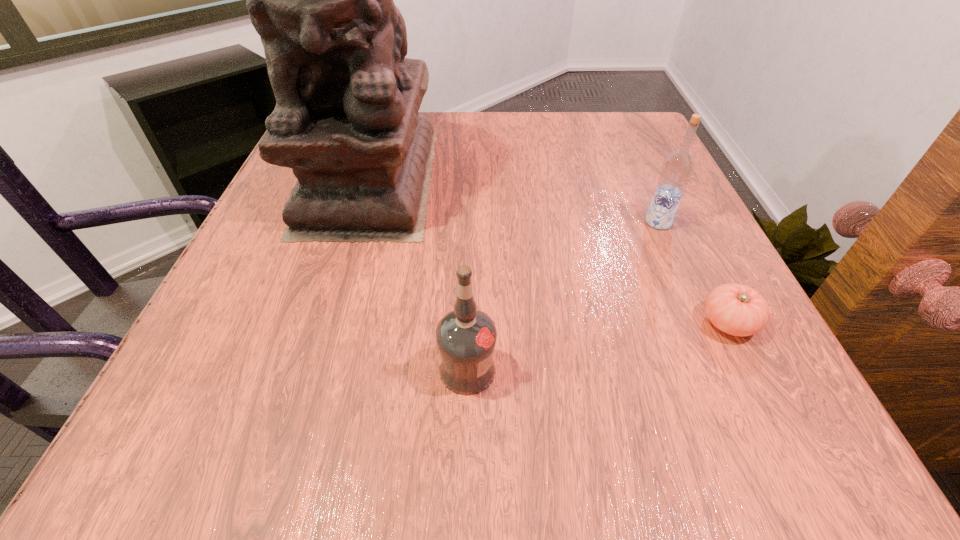
I want to click on free space at the far right corner of the desktop, so click(x=658, y=145).

Where is `free space at the near right corner`? The image size is (960, 540). free space at the near right corner is located at coordinates [x=750, y=433].

Where is `empty space that is in between the second nearest object and the sculpture`? empty space that is in between the second nearest object and the sculpture is located at coordinates (x=549, y=251).

The image size is (960, 540). I want to click on vacant space that's between the right vodka and the shortest object, so click(693, 272).

At what (x,y) coordinates should I click in order to perform the action: click on free space between the right vodka and the tomato. Please return your answer as a coordinate pair (x, y). The height and width of the screenshot is (540, 960). Looking at the image, I should click on (693, 272).

Locate an element on the screen. unoccupied position between the left vodka and the third farthest object is located at coordinates (598, 346).

Find the location of a particular element. vacant area that lies between the third object from right to left and the tallest object is located at coordinates (420, 274).

Where is `vacant space in between the sculpture and the farther vodka`? This screenshot has width=960, height=540. vacant space in between the sculpture and the farther vodka is located at coordinates (515, 200).

The width and height of the screenshot is (960, 540). I want to click on free area in between the second object from left to right and the right vodka, so click(x=564, y=296).

You are a GUI agent. You are given a task and a screenshot of the screen. Output one action in this format:
    pyautogui.click(x=<x>, y=<y>)
    Task: Click on the vacant space that is in between the tallest object and the nearer vodka
    The height and width of the screenshot is (540, 960).
    Given the screenshot: What is the action you would take?
    pyautogui.click(x=420, y=274)